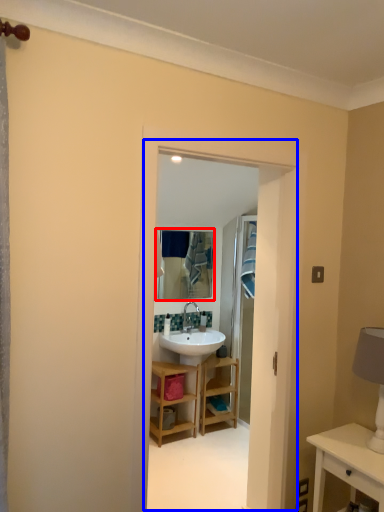
Question: Which point is further to the camera, mirror (highlighted by a red box) or residence (highlighted by a blue box)?

Choices:
 (A) mirror
 (B) residence

Answer: (A)